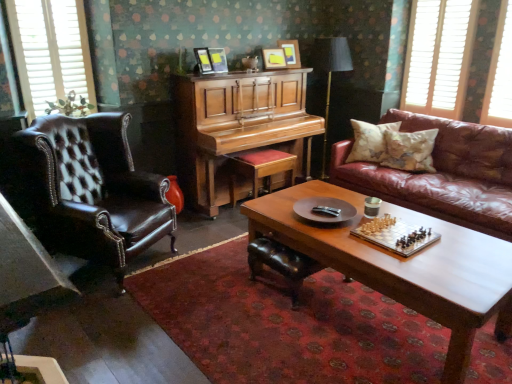
Question: Is patterned fabric pillow at right, marked as the 2th pillow in a left-to-right arrangement, positioned behind white wood window at upper left, which is the first window from left to right?

Choices:
 (A) yes
 (B) no

Answer: (A)

Question: Is patterned fabric pillow at right, which ranks as the 1th pillow in right-to-left order, bigger than white wood window at upper left, arranged as the third window when viewed from the right?

Choices:
 (A) no
 (B) yes

Answer: (B)

Question: From the image's perspective, is patterned fabric pillow at right, marked as the 2th pillow in a left-to-right arrangement, below white wood window at upper left, which is the first window from left to right?

Choices:
 (A) yes
 (B) no

Answer: (A)

Question: Is patterned fabric pillow at right, which ranks as the 1th pillow in right-to-left order, at the right side of white wood window at upper left, which is the first window from left to right?

Choices:
 (A) no
 (B) yes

Answer: (B)

Question: Is white wood window at upper left, arranged as the third window when viewed from the right, at the back of patterned fabric pillow at right, which ranks as the 1th pillow in right-to-left order?

Choices:
 (A) yes
 (B) no

Answer: (B)

Question: From a real-world perspective, is white wooden blinds at upper right, acting as the 2th window starting from the left, above or below polished wood piano at center?

Choices:
 (A) above
 (B) below

Answer: (A)

Question: Choose the correct answer: Is white wooden blinds at upper right, which ranks as the second window in right-to-left order, inside polished wood piano at center or outside it?

Choices:
 (A) inside
 (B) outside

Answer: (B)

Question: Considering their positions, is white wooden blinds at upper right, acting as the 2th window starting from the left, located in front of or behind polished wood piano at center?

Choices:
 (A) front
 (B) behind

Answer: (B)

Question: Based on their positions, is white wooden blinds at upper right, which ranks as the second window in right-to-left order, located to the left or right of polished wood piano at center?

Choices:
 (A) left
 (B) right

Answer: (B)

Question: Looking at the image, does polished wood piano at center seem bigger or smaller compared to white wood window at upper left, which is the first window from left to right?

Choices:
 (A) big
 (B) small

Answer: (A)

Question: In terms of width, does polished wood piano at center look wider or thinner when compared to white wood window at upper left, arranged as the third window when viewed from the right?

Choices:
 (A) wide
 (B) thin

Answer: (A)

Question: Considering their positions, is polished wood piano at center located in front of or behind white wood window at upper left, which is the first window from left to right?

Choices:
 (A) behind
 (B) front

Answer: (A)

Question: Is polished wood piano at center inside or outside of white wood window at upper left, which is the first window from left to right?

Choices:
 (A) outside
 (B) inside

Answer: (A)

Question: From the image's perspective, relative to leather footrest at center, is metallic chess set at center above or below?

Choices:
 (A) below
 (B) above

Answer: (B)

Question: Which is correct: metallic chess set at center is inside leather footrest at center, or outside of it?

Choices:
 (A) outside
 (B) inside

Answer: (A)